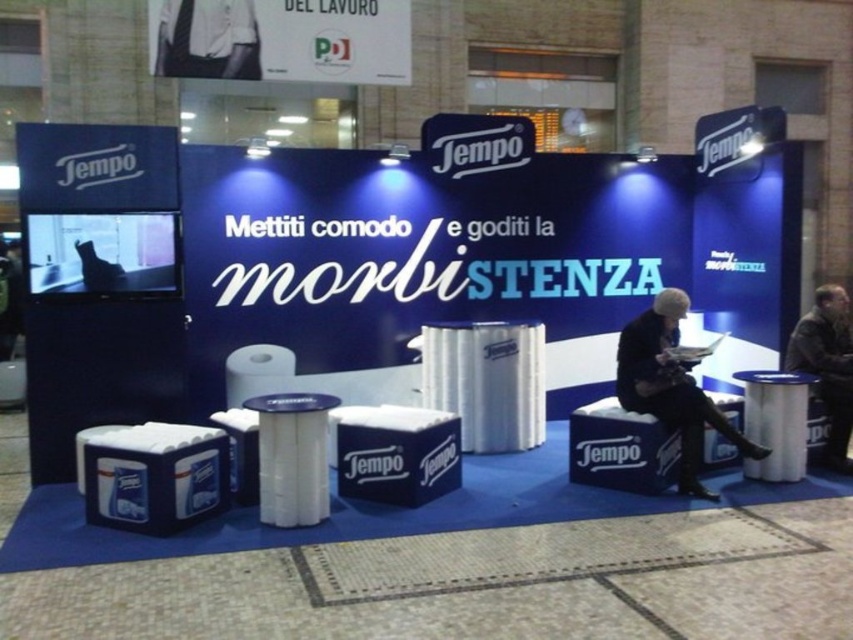
Can you confirm if white shirt at upper left is positioned below white plastic stool at lower right?

→ No, white shirt at upper left is not below white plastic stool at lower right.

Between white shirt at upper left and white plastic stool at lower right, which one appears on the left side from the viewer's perspective?

From the viewer's perspective, white shirt at upper left appears more on the left side.

Locate an element on the screen. The height and width of the screenshot is (640, 853). white shirt at upper left is located at coordinates (207, 38).

Can you confirm if black fabric jacket at lower right is taller than white plastic stool at lower right?

Correct, black fabric jacket at lower right is much taller as white plastic stool at lower right.

Does point (647, 323) come closer to viewer compared to point (766, 417)?

Yes, point (647, 323) is closer to viewer.

Image resolution: width=853 pixels, height=640 pixels. What are the coordinates of `black fabric jacket at lower right` in the screenshot? It's located at (671, 387).

Which of these two, black fabric jacket at lower right or dark brown leather jacket at lower right, stands shorter?

dark brown leather jacket at lower right

Describe the element at coordinates (671, 387) in the screenshot. I see `black fabric jacket at lower right` at that location.

Describe the element at coordinates (671, 387) in the screenshot. I see `black fabric jacket at lower right` at that location.

Find the location of a particular element. This screenshot has height=640, width=853. black fabric jacket at lower right is located at coordinates (671, 387).